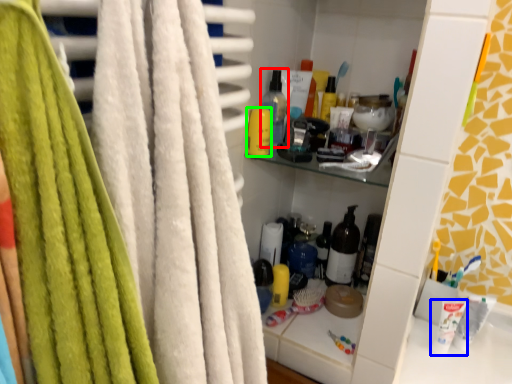
Question: Based on their relative distances, which object is farther from bottle (highlighted by a red box)? Choose from toothpaste (highlighted by a blue box) and toiletry (highlighted by a green box).

Choices:
 (A) toothpaste
 (B) toiletry

Answer: (A)